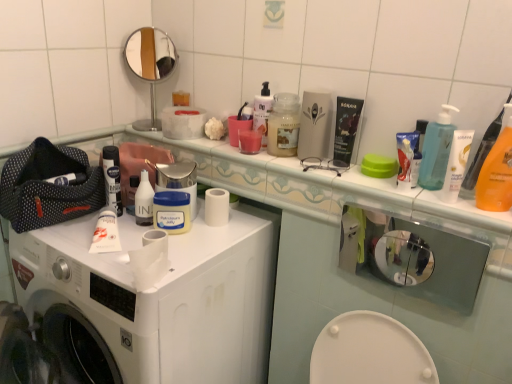
You are a GUI agent. You are given a task and a screenshot of the screen. Output one action in this format:
    pyautogui.click(x=<x>, y=<y>)
    Task: Click on the unoccupied space behind metallic silver glasses at upper center
    The height and width of the screenshot is (384, 512).
    Given the screenshot: What is the action you would take?
    pyautogui.click(x=311, y=163)